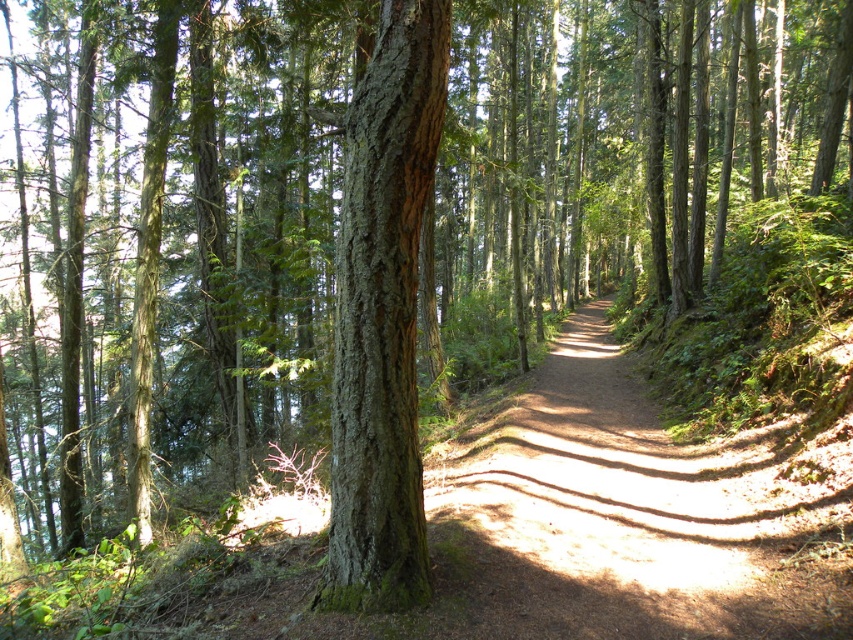
Looking at this image, you are standing at the starting point of the dirt path in the forest. You see the point marked at coordinates (614, 518). Which object is located at that point?

The dirt path at center is located at point (614, 518).